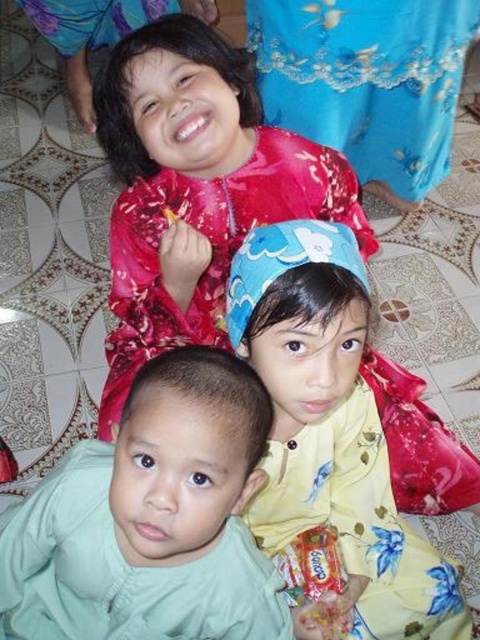
Question: Is yellow floral dress at center smaller than blue satin robe at upper center?

Choices:
 (A) yes
 (B) no

Answer: (B)

Question: Is light green fabric at center smaller than blue satin robe at upper center?

Choices:
 (A) yes
 (B) no

Answer: (B)

Question: Which point is closer to the camera taking this photo?

Choices:
 (A) (66, 483)
 (B) (399, 93)
 (C) (27, 12)

Answer: (A)

Question: Which of the following is the closest to the observer?

Choices:
 (A) (454, 42)
 (B) (163, 4)
 (C) (326, 292)
 (D) (251, 468)

Answer: (D)

Question: Which point is closer to the camera?

Choices:
 (A) (301, 378)
 (B) (284, 36)

Answer: (A)

Question: Can you confirm if light green fabric at center is positioned to the right of blue satin robe at upper center?

Choices:
 (A) no
 (B) yes

Answer: (B)